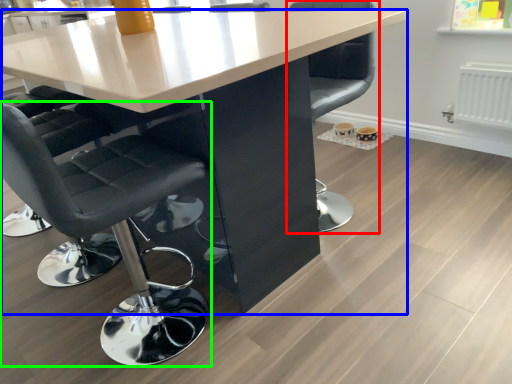
Question: Estimate the real-world distances between objects in this image. Which object is farther from chair (highlighted by a red box), table (highlighted by a blue box) or chair (highlighted by a green box)?

Choices:
 (A) table
 (B) chair

Answer: (B)